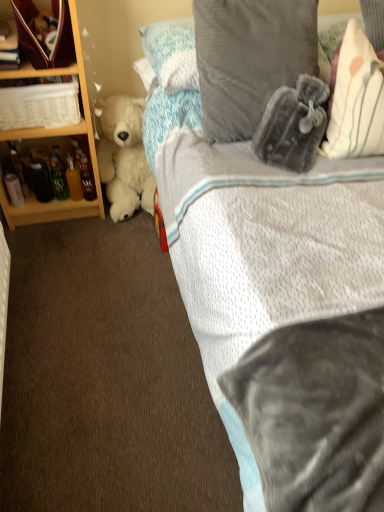
The height and width of the screenshot is (512, 384). Find the location of `velvety gray pillow at upper right, which appears as the first pillow when viewed from the left`. velvety gray pillow at upper right, which appears as the first pillow when viewed from the left is located at coordinates (250, 58).

Where is `velvety gray pillow at upper right`? The height and width of the screenshot is (512, 384). velvety gray pillow at upper right is located at coordinates click(289, 320).

The height and width of the screenshot is (512, 384). What do you see at coordinates (87, 179) in the screenshot? I see `matte glass bottle at left` at bounding box center [87, 179].

You are a GUI agent. You are given a task and a screenshot of the screen. Output one action in this format:
    pyautogui.click(x=<x>, y=<y>)
    Task: Click on the velvet maroon bag at upper left
    Image resolution: width=384 pixels, height=512 pixels.
    Given the screenshot: What is the action you would take?
    pyautogui.click(x=53, y=67)

Considering the relative sizes of wooden bookcase at left and velvety gray pillow at upper right in the image provided, is wooden bookcase at left shorter than velvety gray pillow at upper right?

Incorrect, the height of wooden bookcase at left does not fall short of that of velvety gray pillow at upper right.

Between point (10, 73) and point (253, 206), which one is positioned behind?

Positioned behind is point (10, 73).

Is wooden bookcase at left positioned behind velvety gray pillow at upper right?

Yes, wooden bookcase at left is further from the camera.

Is velvety gray pillow at upper right surrounded by wooden bookcase at left?

That's incorrect, velvety gray pillow at upper right is not inside wooden bookcase at left.

Is white plush teddy bear at left not inside white soft pillow at upper right, placed as the first pillow when sorted from right to left?

Absolutely, white plush teddy bear at left is external to white soft pillow at upper right, placed as the first pillow when sorted from right to left.

Is white plush teddy bear at left to the left or to the right of white soft pillow at upper right, placed as the first pillow when sorted from right to left, in the image?

Based on their positions, white plush teddy bear at left is located to the left of white soft pillow at upper right, placed as the first pillow when sorted from right to left.

Is point (98, 159) positioned before point (328, 116)?

No, it is behind (328, 116).

Looking at this image, from a real-world perspective, is white plush teddy bear at left on white soft pillow at upper right, placed as the first pillow when sorted from right to left?

No, from a real-world perspective, white plush teddy bear at left is not on top of white soft pillow at upper right, placed as the first pillow when sorted from right to left.

Find the location of a particular element. This screenshot has width=384, height=512. shelf above the velvety gray pillow at upper right (from the image's perspective) is located at coordinates (53, 67).

Is velvet maroon bag at upper left outside of velvety gray pillow at upper right?

velvet maroon bag at upper left lies outside velvety gray pillow at upper right's area.

Does velvet maroon bag at upper left turn towards velvety gray pillow at upper right?

No, velvet maroon bag at upper left does not turn towards velvety gray pillow at upper right.

Which object is thinner, white plastic basket at left or velvet maroon bag at upper left?

With smaller width is white plastic basket at left.

Is point (70, 82) closer or farther from the camera than point (12, 21)?

Clearly, point (70, 82) is more distant from the camera than point (12, 21).

Is white plastic basket at left far away from velvet maroon bag at upper left?

No, white plastic basket at left is not far from velvet maroon bag at upper left.

From a real-world perspective, which object rests below the other?

white plastic basket at left, from a real-world perspective.

Is point (234, 119) less distant than point (141, 168)?

Yes, it is in front of point (141, 168).

From the image's perspective, who appears lower, velvety gray pillow at upper right, the 2th pillow in the right-to-left sequence, or white plush teddy bear at left?

white plush teddy bear at left.

Is velvety gray pillow at upper right, the 2th pillow in the right-to-left sequence, not within white plush teddy bear at left?

Yes, velvety gray pillow at upper right, the 2th pillow in the right-to-left sequence, is outside of white plush teddy bear at left.

Can you confirm if velvety gray pillow at upper right, the 2th pillow in the right-to-left sequence, is positioned to the right of white plush teddy bear at left?

Yes.

From the image's perspective, which pillow is the 1st one above the matte glass bottle at left? Please provide its 2D coordinates.

[(355, 99)]

Is matte glass bottle at left wider or thinner than white soft pillow at upper right, placed as the first pillow when sorted from right to left?

matte glass bottle at left is thinner than white soft pillow at upper right, placed as the first pillow when sorted from right to left.

From the image's perspective, between matte glass bottle at left and white soft pillow at upper right, arranged as the 2th pillow when viewed from the left, which one is located above?

white soft pillow at upper right, arranged as the 2th pillow when viewed from the left, is shown above in the image.

Considering the relative positions of white soft pillow at upper right, arranged as the 2th pillow when viewed from the left, and white plush teddy bear at left in the image provided, is white soft pillow at upper right, arranged as the 2th pillow when viewed from the left, to the left of white plush teddy bear at left from the viewer's perspective?

No.

What's the angular difference between white soft pillow at upper right, arranged as the 2th pillow when viewed from the left, and white plush teddy bear at left's facing directions?

They differ by 5.51 degrees in their facing directions.

Relative to white plush teddy bear at left, is white soft pillow at upper right, arranged as the 2th pillow when viewed from the left, in front or behind?

Visually, white soft pillow at upper right, arranged as the 2th pillow when viewed from the left, is located in front of white plush teddy bear at left.

From the image's perspective, which one is positioned lower, white soft pillow at upper right, placed as the first pillow when sorted from right to left, or white plush teddy bear at left?

white plush teddy bear at left appears lower in the image.

Identify the location of bed below the wooden bookcase at left (from a real-world perspective). This screenshot has width=384, height=512. (289, 320).

Image resolution: width=384 pixels, height=512 pixels. What are the coordinates of `teddy bear located on the left of white soft pillow at upper right, arranged as the 2th pillow when viewed from the left` in the screenshot? It's located at (124, 157).

Based on their spatial positions, is white plastic basket at left or wooden bookcase at left further from velvety gray pillow at upper right?

wooden bookcase at left.

Estimate the real-world distances between objects in this image. Which object is closer to velvety gray pillow at upper right, the 2th pillow in the right-to-left sequence, wooden bookcase at left or matte glass bottle at left?

The object closer to velvety gray pillow at upper right, the 2th pillow in the right-to-left sequence, is wooden bookcase at left.

Consider the image. Looking at the image, which one is located closer to velvety gray pillow at upper right, velvet maroon bag at upper left or white plastic basket at left?

white plastic basket at left.

Looking at the image, which one is located closer to velvety gray pillow at upper right, the 2th pillow in the right-to-left sequence, wooden bookcase at left or white plastic basket at left?

Based on the image, wooden bookcase at left appears to be nearer to velvety gray pillow at upper right, the 2th pillow in the right-to-left sequence.

Which object lies further to the anchor point white soft pillow at upper right, arranged as the 2th pillow when viewed from the left, white plastic basket at left or velvety gray pillow at upper right, which appears as the first pillow when viewed from the left?

white plastic basket at left is further to white soft pillow at upper right, arranged as the 2th pillow when viewed from the left.

In the scene shown: Considering their positions, is velvety gray pillow at upper right positioned further to wooden bookcase at left than matte glass bottle at left?

velvety gray pillow at upper right.

When comparing their distances from wooden bookcase at left, does white plastic basket at left or velvety gray pillow at upper right seem further?

The object further to wooden bookcase at left is velvety gray pillow at upper right.

Based on their spatial positions, is velvety gray pillow at upper right or white plastic basket at left further from velvet maroon bag at upper left?

velvety gray pillow at upper right is further to velvet maroon bag at upper left.

Where is `bottle between wooden bookcase at left and velvety gray pillow at upper right`? The width and height of the screenshot is (384, 512). bottle between wooden bookcase at left and velvety gray pillow at upper right is located at coordinates (87, 179).

Image resolution: width=384 pixels, height=512 pixels. In order to click on shelf between white plastic basket at left and velvety gray pillow at upper right, the 2th pillow in the right-to-left sequence in this screenshot , I will do `click(53, 67)`.

Find the location of `teddy bear located between velvet maroon bag at upper left and velvety gray pillow at upper right in the left-right direction`. teddy bear located between velvet maroon bag at upper left and velvety gray pillow at upper right in the left-right direction is located at coordinates (124, 157).

Find the location of a particular element. The image size is (384, 512). teddy bear between wooden bookcase at left and velvety gray pillow at upper right, the 2th pillow in the right-to-left sequence is located at coordinates (124, 157).